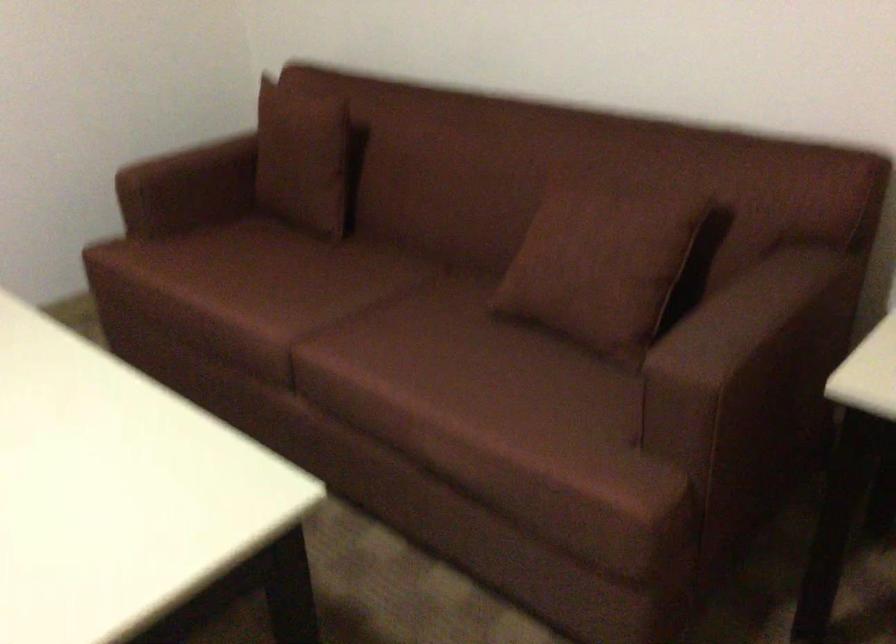
Locate an element on the screen. sofa sitting surface is located at coordinates (286, 283).